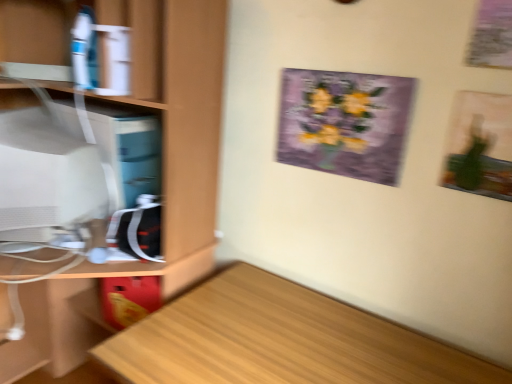
Question: Could you tell me if purple paper picture frame at upper center is facing light wood desk at lower left?

Choices:
 (A) yes
 (B) no

Answer: (B)

Question: Is purple paper picture frame at upper center positioned beyond the bounds of light wood desk at lower left?

Choices:
 (A) no
 (B) yes

Answer: (B)

Question: Considering the relative sizes of purple paper picture frame at upper center and light wood desk at lower left in the image provided, is purple paper picture frame at upper center taller than light wood desk at lower left?

Choices:
 (A) yes
 (B) no

Answer: (B)

Question: From a real-world perspective, does purple paper picture frame at upper center stand above light wood desk at lower left?

Choices:
 (A) yes
 (B) no

Answer: (A)

Question: Would you say purple paper picture frame at upper center contains light wood desk at lower left?

Choices:
 (A) no
 (B) yes

Answer: (A)

Question: From the image's perspective, is matte white monitor at left positioned above or below light wood desk at lower left?

Choices:
 (A) below
 (B) above

Answer: (B)

Question: In terms of size, does matte white monitor at left appear bigger or smaller than light wood desk at lower left?

Choices:
 (A) small
 (B) big

Answer: (A)

Question: Is matte white monitor at left inside the boundaries of light wood desk at lower left, or outside?

Choices:
 (A) outside
 (B) inside

Answer: (A)

Question: In the image, is matte white monitor at left positioned in front of or behind light wood desk at lower left?

Choices:
 (A) front
 (B) behind

Answer: (B)

Question: Looking at the image, does matte white monitor at left seem bigger or smaller compared to purple paper picture frame at upper center?

Choices:
 (A) big
 (B) small

Answer: (A)

Question: From the image's perspective, is matte white monitor at left above or below purple paper picture frame at upper center?

Choices:
 (A) below
 (B) above

Answer: (A)

Question: Considering the positions of point (11, 127) and point (343, 155), is point (11, 127) closer or farther from the camera than point (343, 155)?

Choices:
 (A) closer
 (B) farther

Answer: (A)

Question: From a real-world perspective, is matte white monitor at left physically located above or below purple paper picture frame at upper center?

Choices:
 (A) above
 (B) below

Answer: (B)

Question: Relative to light wood desk at lower left, is wooden cabinet at left in front or behind?

Choices:
 (A) front
 (B) behind

Answer: (B)

Question: Is wooden cabinet at left inside the boundaries of light wood desk at lower left, or outside?

Choices:
 (A) inside
 (B) outside

Answer: (B)